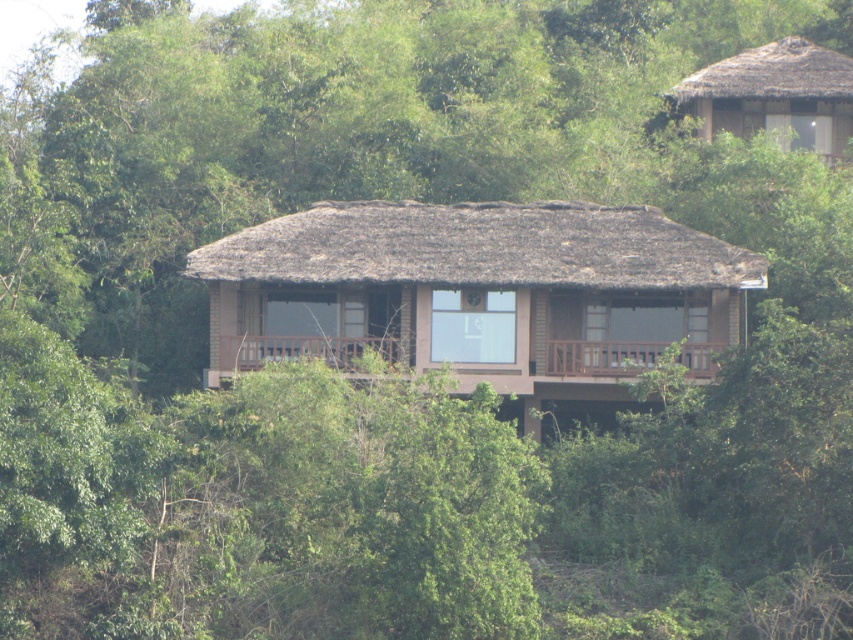
Question: Which object appears closest to the camera in this image?

Choices:
 (A) brown thatched roof hut at center
 (B) thatched straw hut at upper right

Answer: (A)

Question: Considering the relative positions of brown thatched roof hut at center and thatched straw hut at upper right in the image provided, where is brown thatched roof hut at center located with respect to thatched straw hut at upper right?

Choices:
 (A) left
 (B) right

Answer: (A)

Question: Which point is closer to the camera?

Choices:
 (A) thatched straw hut at upper right
 (B) brown thatched roof hut at center

Answer: (B)

Question: Can you confirm if brown thatched roof hut at center is thinner than thatched straw hut at upper right?

Choices:
 (A) no
 (B) yes

Answer: (A)

Question: Does brown thatched roof hut at center appear on the left side of thatched straw hut at upper right?

Choices:
 (A) no
 (B) yes

Answer: (B)

Question: Which of the following is the farthest from the observer?

Choices:
 (A) brown thatched roof hut at center
 (B) thatched straw hut at upper right

Answer: (B)